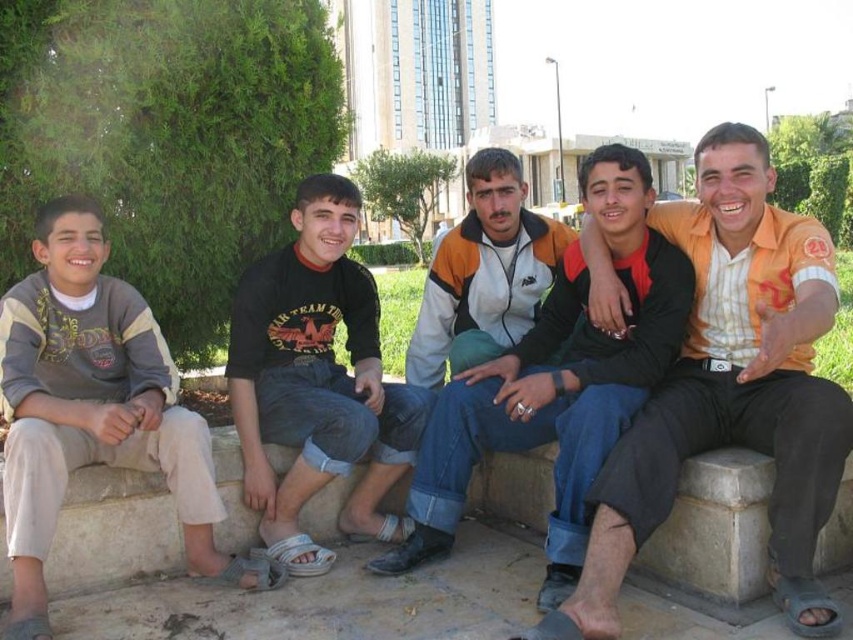
Is orange striped shirt at center in front of gray cotton pants at left?

No.

Measure the distance between orange striped shirt at center and gray cotton pants at left.

orange striped shirt at center is 7.35 meters away from gray cotton pants at left.

Which is in front, point (660, 452) or point (129, 300)?

Positioned in front is point (660, 452).

Image resolution: width=853 pixels, height=640 pixels. Find the location of `orange striped shirt at center`. orange striped shirt at center is located at coordinates (730, 388).

Between point (780, 493) and point (332, 465), which one is positioned in front?

Point (780, 493) is more forward.

Is point (590, 636) closer to viewer compared to point (316, 337)?

Yes.

Identify the location of orange striped shirt at center. (730, 388).

Which is behind, point (396, 570) or point (370, 532)?

The point (370, 532) is behind.

You are a GUI agent. You are given a task and a screenshot of the screen. Output one action in this format:
    pyautogui.click(x=<x>, y=<y>)
    Task: Click on the orange and white jacket at center
    
    Given the screenshot: What is the action you would take?
    pyautogui.click(x=558, y=381)

What are the coordinates of `orange and white jacket at center` in the screenshot? It's located at (558, 381).